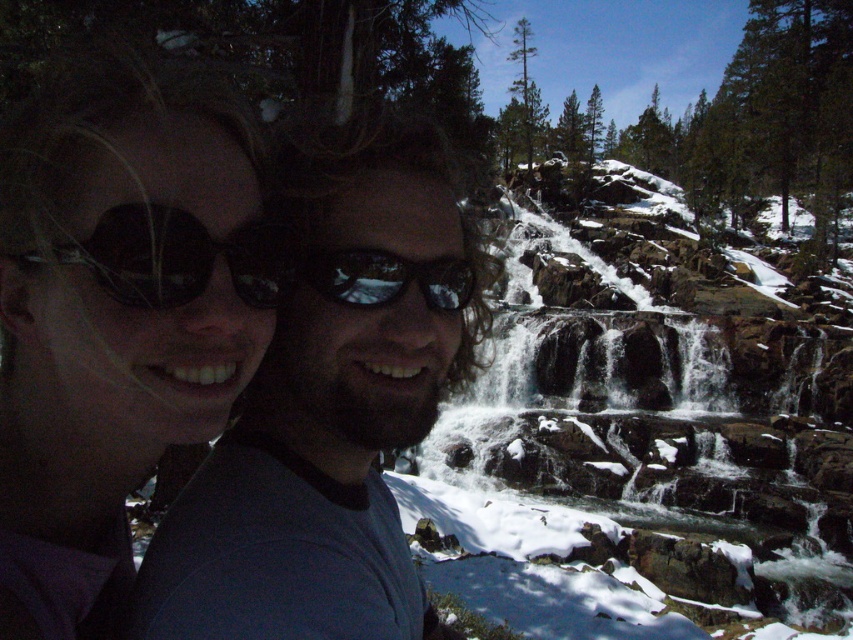
Is matte black sunglasses at center above black reflective sunglasses at left?

No.

From the picture: Is matte black sunglasses at center thinner than black reflective sunglasses at left?

In fact, matte black sunglasses at center might be wider than black reflective sunglasses at left.

I want to click on matte black sunglasses at center, so click(x=329, y=408).

Identify the location of matte black sunglasses at center. (329, 408).

Between black reflective sunglasses at left and black reflective sunglasses at center, which one is positioned higher?

black reflective sunglasses at left is above.

Is point (196, 296) farther from viewer compared to point (357, 300)?

No.

The height and width of the screenshot is (640, 853). In order to click on black reflective sunglasses at left in this screenshot , I will do `click(178, 257)`.

Which is in front, point (78, 289) or point (399, 189)?

Point (78, 289) is more forward.

Does matte black sunglasses at upper left appear over matte black sunglasses at center?

Indeed, matte black sunglasses at upper left is positioned over matte black sunglasses at center.

The height and width of the screenshot is (640, 853). What do you see at coordinates (115, 316) in the screenshot?
I see `matte black sunglasses at upper left` at bounding box center [115, 316].

The height and width of the screenshot is (640, 853). I want to click on matte black sunglasses at upper left, so 115,316.